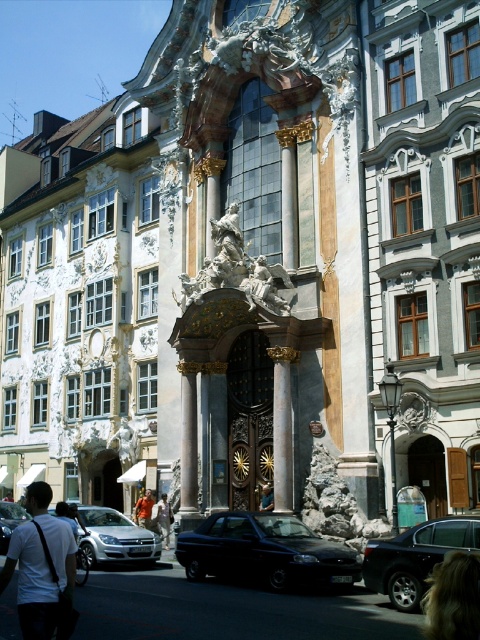
Consider the image. You are a photographer planning to take a portrait of the light brown leather jacket at center while ensuring the black metallic car at lower center is also visible in the frame. Given their sizes, which object should you position closer to the camera to achieve this composition?

Since the black metallic car at lower center is larger than the light brown leather jacket at center, you should position the light brown leather jacket at center closer to the camera to ensure both are visible in the frame while maintaining their relative sizes.

You are a pedestrian standing on the sidewalk in front of the historic building. You see a black metallic car at lower center and a light brown leather jacket at center. Which object is closer to you?

The black metallic car at lower center is closer to you because it is in front of the light brown leather jacket at center.

You are standing in front of the historic building and notice a detail at the lower right corner of the image. What are the coordinates of the blonde hair at lower right?

The coordinates of the blonde hair at lower right are at point (453, 598).